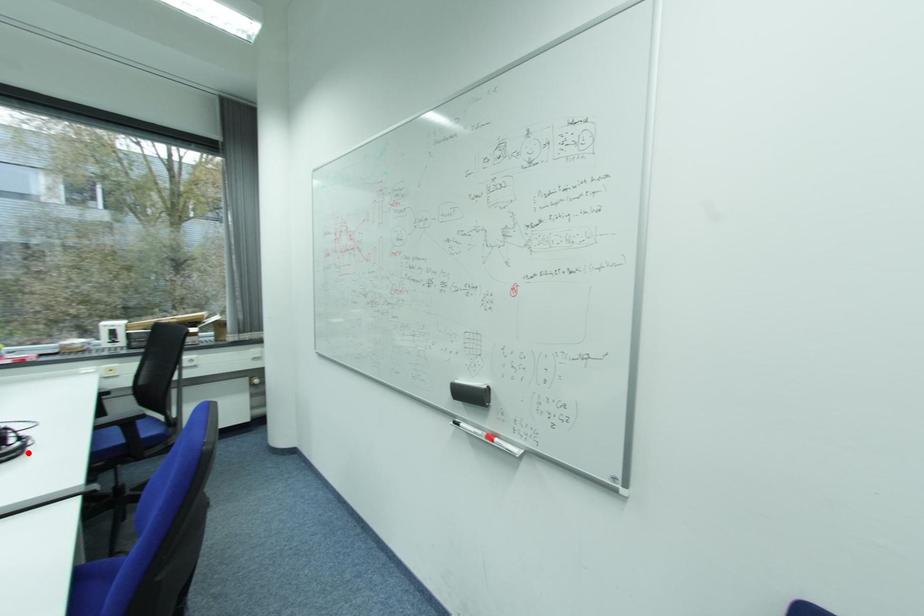
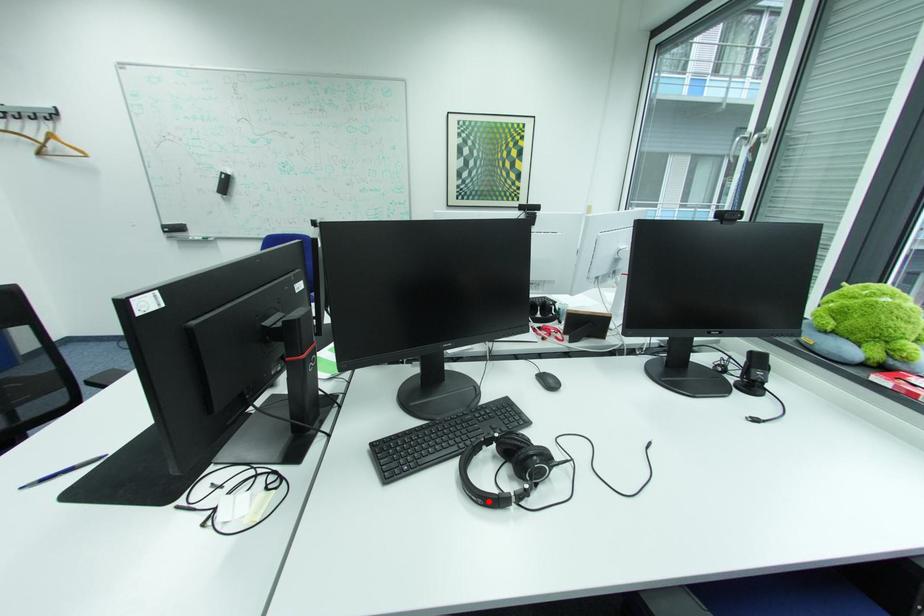
I am providing you with two images of the same scene from different viewpoints. A red point is marked on the first image and another point is marked on the second image. Is the red point in image1 aligned with the point shown in image2?

Yes